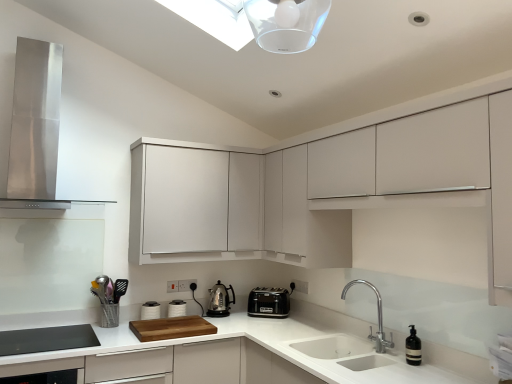
Question: Is stainless steel range hood at upper left outside of white matte cabinet at upper center, positioned as the 1th cabinetry in left-to-right order?

Choices:
 (A) yes
 (B) no

Answer: (A)

Question: Is stainless steel range hood at upper left taller than white matte cabinet at upper center, acting as the second cabinetry starting from the right?

Choices:
 (A) no
 (B) yes

Answer: (B)

Question: Can you confirm if stainless steel range hood at upper left is smaller than white matte cabinet at upper center, acting as the second cabinetry starting from the right?

Choices:
 (A) yes
 (B) no

Answer: (B)

Question: Does stainless steel range hood at upper left have a lesser width compared to white matte cabinet at upper center, positioned as the 1th cabinetry in left-to-right order?

Choices:
 (A) yes
 (B) no

Answer: (B)

Question: Is stainless steel range hood at upper left positioned behind white matte cabinet at upper center, acting as the second cabinetry starting from the right?

Choices:
 (A) no
 (B) yes

Answer: (A)

Question: In the image, is black glass dishwasher at lower left positioned in front of or behind stainless steel range hood at upper left?

Choices:
 (A) behind
 (B) front

Answer: (B)

Question: In terms of size, does black glass dishwasher at lower left appear bigger or smaller than stainless steel range hood at upper left?

Choices:
 (A) big
 (B) small

Answer: (B)

Question: Is black glass dishwasher at lower left inside or outside of stainless steel range hood at upper left?

Choices:
 (A) inside
 (B) outside

Answer: (B)

Question: Looking at their shapes, would you say black glass dishwasher at lower left is wider or thinner than stainless steel range hood at upper left?

Choices:
 (A) wide
 (B) thin

Answer: (A)

Question: Would you say black plastic toaster at center, the second kitchen appliance in the left-to-right sequence, is to the left or to the right of black glass dishwasher at lower left in the picture?

Choices:
 (A) left
 (B) right

Answer: (B)

Question: Considering the positions of point (270, 316) and point (4, 370), is point (270, 316) closer or farther from the camera than point (4, 370)?

Choices:
 (A) closer
 (B) farther

Answer: (B)

Question: Is black plastic toaster at center, marked as the first kitchen appliance in a right-to-left arrangement, bigger or smaller than black glass dishwasher at lower left?

Choices:
 (A) big
 (B) small

Answer: (B)

Question: Would you say black plastic toaster at center, the second kitchen appliance in the left-to-right sequence, is inside or outside black glass dishwasher at lower left?

Choices:
 (A) inside
 (B) outside

Answer: (B)

Question: In terms of width, does black plastic toaster at center, marked as the first kitchen appliance in a right-to-left arrangement, look wider or thinner when compared to stainless steel range hood at upper left?

Choices:
 (A) wide
 (B) thin

Answer: (B)

Question: From a real-world perspective, relative to stainless steel range hood at upper left, is black plastic toaster at center, marked as the first kitchen appliance in a right-to-left arrangement, vertically above or below?

Choices:
 (A) above
 (B) below

Answer: (B)